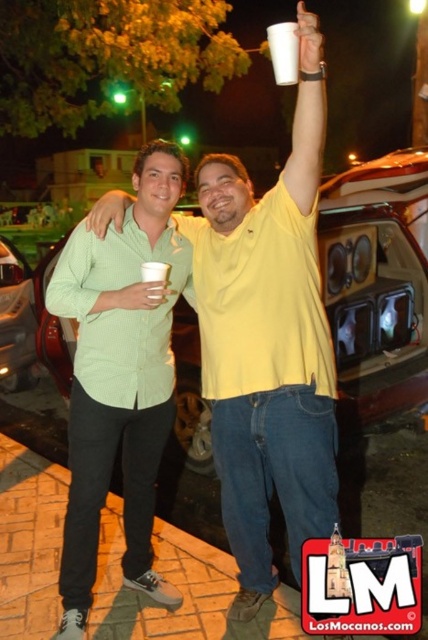
Looking at this image, you are a photographer trying to capture a clear shot of the green matte shirt at center and the white paper cup at upper center. Which object is partially hidden from your view?

The white paper cup at upper center is behind the green matte shirt at center, so it is partially hidden from view.

You are at a nighttime gathering and see the green matte shirt at center and the white paper cup at upper center. Which object is higher in the image?

The green matte shirt at center is taller than the white paper cup at upper center, so the green matte shirt at center is higher in the image.

You are standing at the origin point in the image. There is a metallic silver car represented by point (x=377, y=284). Is the car closer to you or further away compared to the parked red car with its trunk open?

The metallic silver car at center is represented by point (x=377, y=284). Since the red car is mentioned in the scene description as having its trunk open with speakers, but no coordinate is provided, we cannot determine the exact distance between them based on the given information.